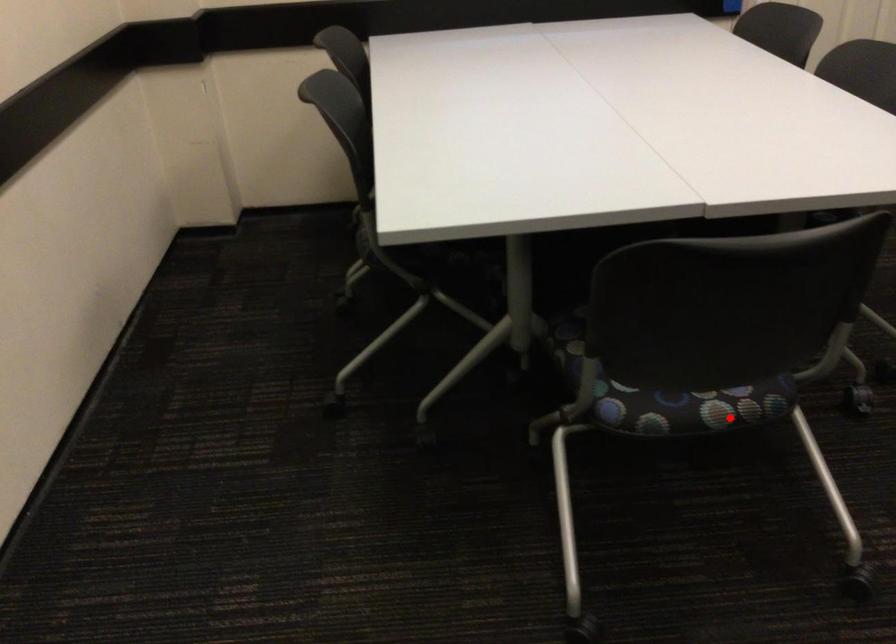
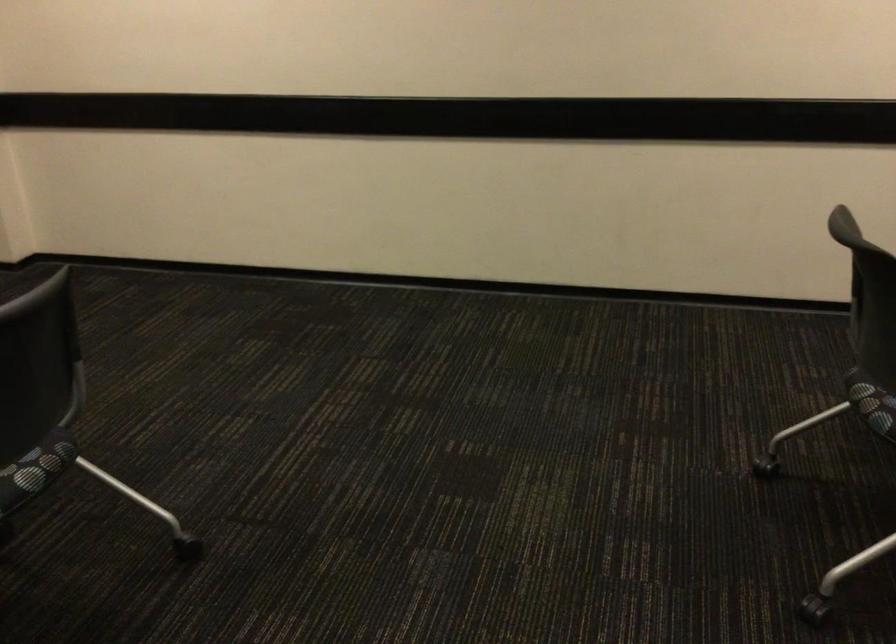
Find the pixel in the second image that matches the highlighted location in the first image.

(874, 408)